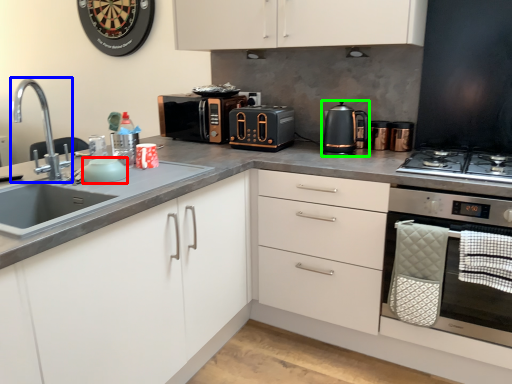
Question: Based on their relative distances, which object is nearer to appliance (highlighted by a red box)? Choose from tap (highlighted by a blue box) and kitchen appliance (highlighted by a green box).

Choices:
 (A) tap
 (B) kitchen appliance

Answer: (B)